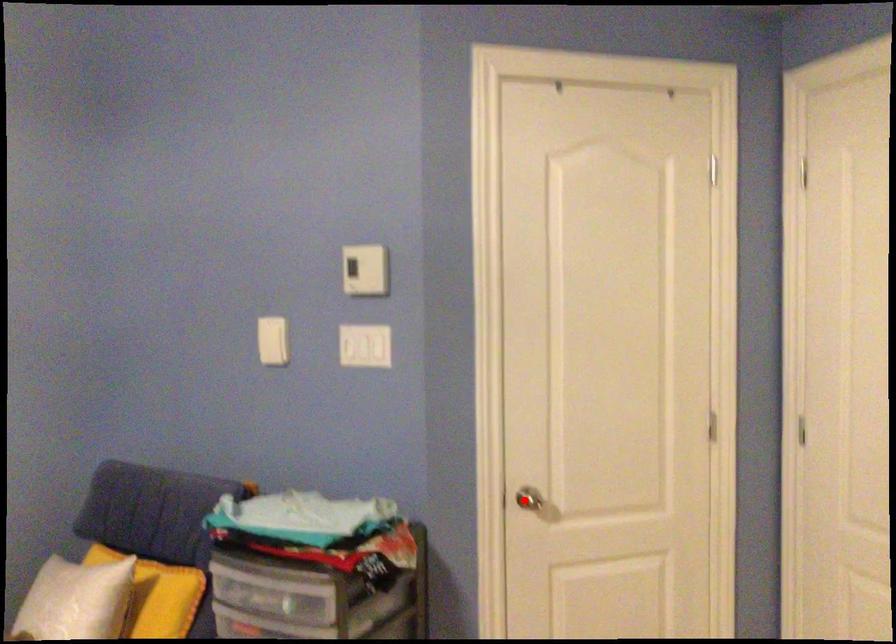
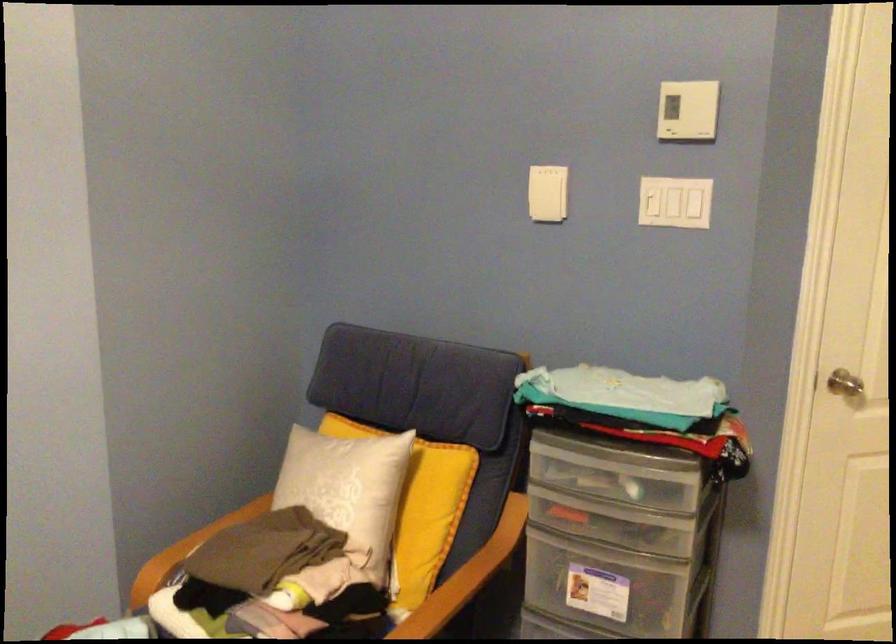
Question: I am providing you with two images of the same scene from different viewpoints. A red point is shown in image1. For the corresponding object point in image2, is it positioned nearer or farther from the camera?

Choices:
 (A) Nearer
 (B) Farther

Answer: (A)